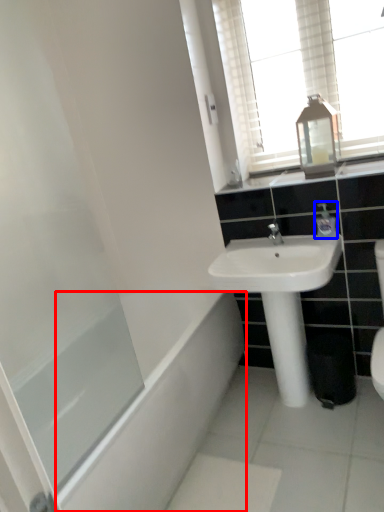
Question: Which point is closer to the camera, bath (highlighted by a red box) or toiletry (highlighted by a blue box)?

Choices:
 (A) bath
 (B) toiletry

Answer: (A)